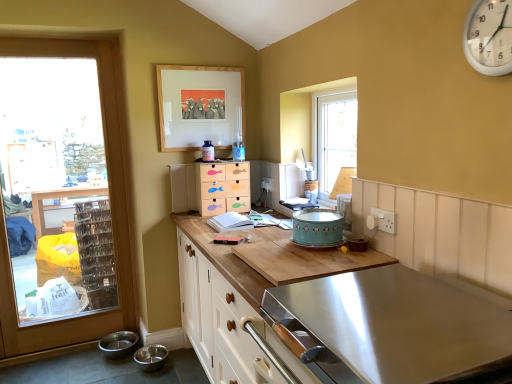
At what (x,y) coordinates should I click in order to perform the action: click on vacant area to the left of teal matte cake stand at center, acting as the second appliance starting from the back. Please return your answer as a coordinate pair (x, y). Looking at the image, I should click on (264, 235).